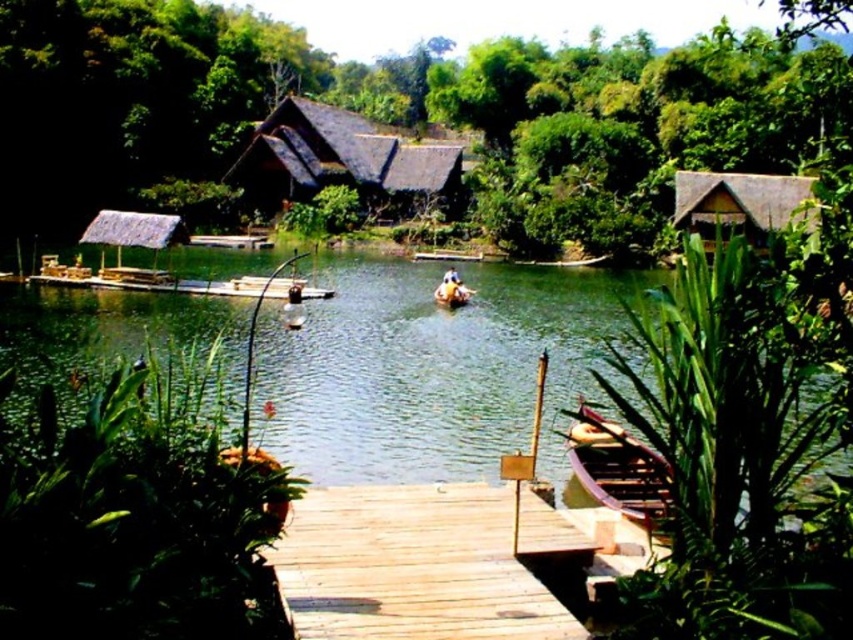
You are standing on the wooden dock and want to take a photo of the wooden boat at lower right without the green leafy vegetation at upper center blocking the view. Which direction should you move to ensure the vegetation doesn t block your shot?

You should move to the left side of the wooden dock because the green leafy vegetation at upper center is positioned over the wooden boat at lower right. Moving left would shift your angle, allowing you to capture the boat without the vegetation obstructing the view.

You are standing on the wooden dock and want to move from the green leafy plant at lower left to the wooden boat at lower right. Considering their widths, which object will you have to navigate around more carefully?

The wooden boat at lower right has a greater width than the green leafy plant at lower left, so you will need to navigate around it more carefully due to its larger size.

You are a gardener standing at the center of the dock and want to water both the green leafy plant at lower right and the green leafy plant at lower left. Given that your watering can has a range of 9 meters, can you reach both plants from your current position without moving?

The green leafy plant at lower right is 8.99 meters from the green leafy plant at lower left. Since your watering can has a range of 9 meters, you can reach both plants from the center of the dock as the distance between them is within the range.